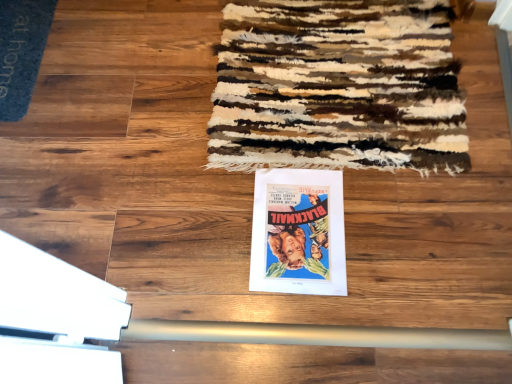
The width and height of the screenshot is (512, 384). Find the location of `vacant space underneath blue carpet at upper left (from a real-world perspective)`. vacant space underneath blue carpet at upper left (from a real-world perspective) is located at coordinates click(x=16, y=47).